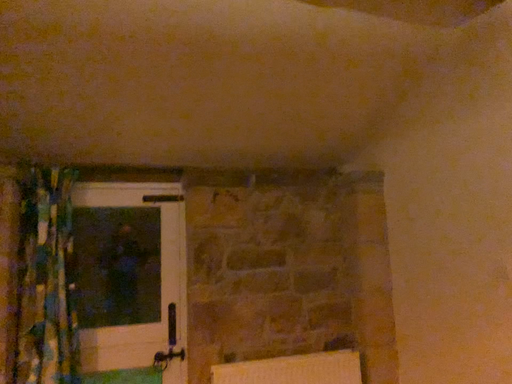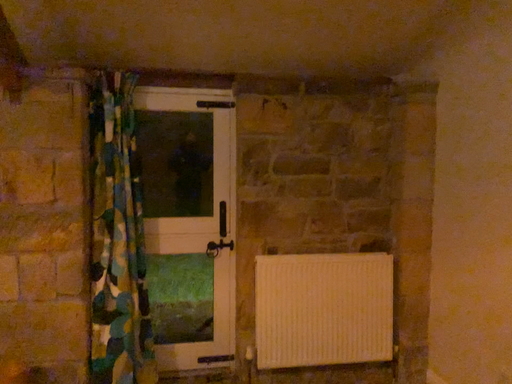
Question: How did the camera likely rotate when shooting the video?

Choices:
 (A) rotated right
 (B) rotated left

Answer: (B)